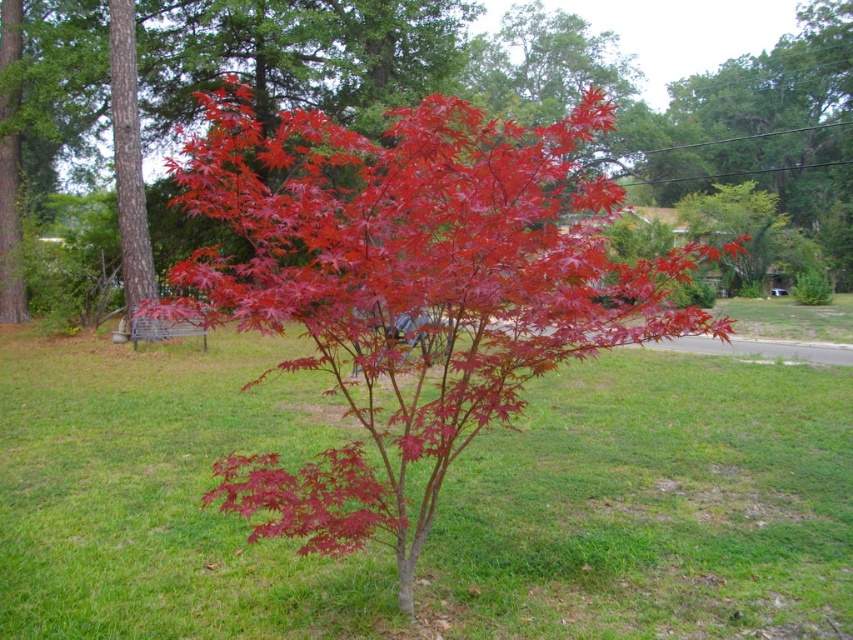
Question: Is green grass at center above glossy red maple at center?

Choices:
 (A) yes
 (B) no

Answer: (B)

Question: Can you confirm if glossy red maple at center is smaller than glossy red maple leaf at center?

Choices:
 (A) no
 (B) yes

Answer: (A)

Question: Does green grass at center come behind glossy red maple leaf at center?

Choices:
 (A) no
 (B) yes

Answer: (B)

Question: Which object is the closest to the green grass at center?

Choices:
 (A) glossy red maple at center
 (B) bright red leaves at center
 (C) glossy red maple leaf at center

Answer: (C)

Question: Which object is farther from the camera taking this photo?

Choices:
 (A) bright red leaves at center
 (B) green grass at center
 (C) glossy red maple leaf at center

Answer: (A)

Question: Among these points, which one is farthest from the camera?

Choices:
 (A) (605, 577)
 (B) (323, 536)

Answer: (A)